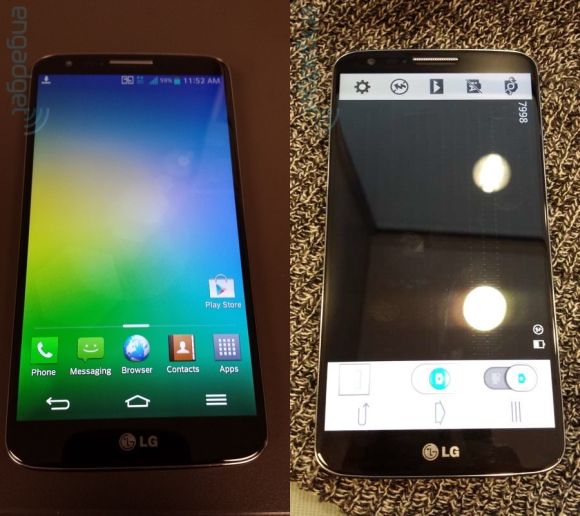
I want to click on carpet or rug, so click(556, 109).